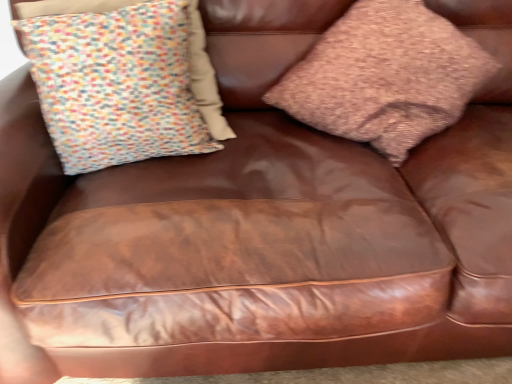
Describe the element at coordinates (123, 84) in the screenshot. This screenshot has height=384, width=512. I see `multicolored fabric pillow at upper left, which appears as the second pillow when viewed from the right` at that location.

At what (x,y) coordinates should I click in order to perform the action: click on multicolored fabric pillow at upper left, which appears as the second pillow when viewed from the right. Please return your answer as a coordinate pair (x, y). Looking at the image, I should click on (123, 84).

Identify the location of brown textured pillow at upper right, the 2th pillow viewed from the left. (385, 76).

Measure the distance between brown textured pillow at upper right, which is counted as the first pillow, starting from the right, and camera.

The distance of brown textured pillow at upper right, which is counted as the first pillow, starting from the right, from camera is 1.05 meters.

Describe the element at coordinates (385, 76) in the screenshot. I see `brown textured pillow at upper right, which is counted as the first pillow, starting from the right` at that location.

Locate an element on the screen. This screenshot has width=512, height=384. multicolored fabric pillow at upper left, which appears as the second pillow when viewed from the right is located at coordinates (123, 84).

Which object is positioned more to the right, multicolored fabric pillow at upper left, acting as the 1th pillow starting from the left, or brown textured pillow at upper right, the 2th pillow viewed from the left?

Positioned to the right is brown textured pillow at upper right, the 2th pillow viewed from the left.

Does multicolored fabric pillow at upper left, which appears as the second pillow when viewed from the right, come in front of brown textured pillow at upper right, the 2th pillow viewed from the left?

No, multicolored fabric pillow at upper left, which appears as the second pillow when viewed from the right, is further to the viewer.

Is point (68, 46) positioned before point (388, 145)?

Yes.

From the image's perspective, is multicolored fabric pillow at upper left, which appears as the second pillow when viewed from the right, under brown textured pillow at upper right, which is counted as the first pillow, starting from the right?

Yes, from the image's perspective, multicolored fabric pillow at upper left, which appears as the second pillow when viewed from the right, is beneath brown textured pillow at upper right, which is counted as the first pillow, starting from the right.

From a real-world perspective, is multicolored fabric pillow at upper left, which appears as the second pillow when viewed from the right, physically above brown textured pillow at upper right, the 2th pillow viewed from the left?

Yes.

In the scene shown: Does multicolored fabric pillow at upper left, which appears as the second pillow when viewed from the right, have a greater width compared to brown textured pillow at upper right, the 2th pillow viewed from the left?

Incorrect, the width of multicolored fabric pillow at upper left, which appears as the second pillow when viewed from the right, does not surpass that of brown textured pillow at upper right, the 2th pillow viewed from the left.

Can you confirm if multicolored fabric pillow at upper left, acting as the 1th pillow starting from the left, is taller than brown textured pillow at upper right, which is counted as the first pillow, starting from the right?

No.

Is multicolored fabric pillow at upper left, acting as the 1th pillow starting from the left, bigger or smaller than brown textured pillow at upper right, which is counted as the first pillow, starting from the right?

Considering their sizes, multicolored fabric pillow at upper left, acting as the 1th pillow starting from the left, takes up less space than brown textured pillow at upper right, which is counted as the first pillow, starting from the right.

From the picture: Do you think multicolored fabric pillow at upper left, which appears as the second pillow when viewed from the right, is within brown textured pillow at upper right, the 2th pillow viewed from the left, or outside of it?

multicolored fabric pillow at upper left, which appears as the second pillow when viewed from the right, is not inside brown textured pillow at upper right, the 2th pillow viewed from the left, it's outside.

Is multicolored fabric pillow at upper left, which appears as the second pillow when viewed from the right, not close to brown textured pillow at upper right, the 2th pillow viewed from the left?

multicolored fabric pillow at upper left, which appears as the second pillow when viewed from the right, is near brown textured pillow at upper right, the 2th pillow viewed from the left, not far away.

Is multicolored fabric pillow at upper left, which appears as the second pillow when viewed from the right, looking in the opposite direction of brown textured pillow at upper right, the 2th pillow viewed from the left?

That's not correct — multicolored fabric pillow at upper left, which appears as the second pillow when viewed from the right, is not looking away from brown textured pillow at upper right, the 2th pillow viewed from the left.

What's the angular difference between multicolored fabric pillow at upper left, acting as the 1th pillow starting from the left, and brown textured pillow at upper right, which is counted as the first pillow, starting from the right,'s facing directions?

The angular difference between multicolored fabric pillow at upper left, acting as the 1th pillow starting from the left, and brown textured pillow at upper right, which is counted as the first pillow, starting from the right, is 7.88 degrees.

At what (x,y) coordinates should I click in order to perform the action: click on pillow behind the brown textured pillow at upper right, the 2th pillow viewed from the left. Please return your answer as a coordinate pair (x, y). The width and height of the screenshot is (512, 384). Looking at the image, I should click on (123, 84).

Is brown textured pillow at upper right, which is counted as the first pillow, starting from the right, to the right of multicolored fabric pillow at upper left, which appears as the second pillow when viewed from the right, from the viewer's perspective?

Yes, brown textured pillow at upper right, which is counted as the first pillow, starting from the right, is to the right of multicolored fabric pillow at upper left, which appears as the second pillow when viewed from the right.

Considering the positions of objects brown textured pillow at upper right, which is counted as the first pillow, starting from the right, and multicolored fabric pillow at upper left, which appears as the second pillow when viewed from the right, in the image provided, who is in front, brown textured pillow at upper right, which is counted as the first pillow, starting from the right, or multicolored fabric pillow at upper left, which appears as the second pillow when viewed from the right,?

brown textured pillow at upper right, which is counted as the first pillow, starting from the right, is more forward.

Does point (462, 91) lie in front of point (76, 73)?

No.

From the image's perspective, is brown textured pillow at upper right, which is counted as the first pillow, starting from the right, located above or below multicolored fabric pillow at upper left, which appears as the second pillow when viewed from the right?

Based on their image positions, brown textured pillow at upper right, which is counted as the first pillow, starting from the right, is located above multicolored fabric pillow at upper left, which appears as the second pillow when viewed from the right.

From a real-world perspective, between brown textured pillow at upper right, which is counted as the first pillow, starting from the right, and multicolored fabric pillow at upper left, which appears as the second pillow when viewed from the right, who is vertically higher?

In real-world perspective, multicolored fabric pillow at upper left, which appears as the second pillow when viewed from the right, is above.

Which of these two, brown textured pillow at upper right, the 2th pillow viewed from the left, or multicolored fabric pillow at upper left, which appears as the second pillow when viewed from the right, is wider?

brown textured pillow at upper right, the 2th pillow viewed from the left, is wider.

Considering the relative sizes of brown textured pillow at upper right, which is counted as the first pillow, starting from the right, and multicolored fabric pillow at upper left, acting as the 1th pillow starting from the left, in the image provided, is brown textured pillow at upper right, which is counted as the first pillow, starting from the right, taller than multicolored fabric pillow at upper left, acting as the 1th pillow starting from the left,?

Indeed, brown textured pillow at upper right, which is counted as the first pillow, starting from the right, has a greater height compared to multicolored fabric pillow at upper left, acting as the 1th pillow starting from the left.

Between brown textured pillow at upper right, the 2th pillow viewed from the left, and multicolored fabric pillow at upper left, acting as the 1th pillow starting from the left, which one has larger size?

With larger size is brown textured pillow at upper right, the 2th pillow viewed from the left.

Would you say brown textured pillow at upper right, which is counted as the first pillow, starting from the right, is outside multicolored fabric pillow at upper left, which appears as the second pillow when viewed from the right?

Absolutely, brown textured pillow at upper right, which is counted as the first pillow, starting from the right, is external to multicolored fabric pillow at upper left, which appears as the second pillow when viewed from the right.

Is brown textured pillow at upper right, the 2th pillow viewed from the left, touching multicolored fabric pillow at upper left, acting as the 1th pillow starting from the left?

There is a gap between brown textured pillow at upper right, the 2th pillow viewed from the left, and multicolored fabric pillow at upper left, acting as the 1th pillow starting from the left.

Is brown textured pillow at upper right, which is counted as the first pillow, starting from the right, looking in the opposite direction of multicolored fabric pillow at upper left, which appears as the second pillow when viewed from the right?

That's not correct — brown textured pillow at upper right, which is counted as the first pillow, starting from the right, is not looking away from multicolored fabric pillow at upper left, which appears as the second pillow when viewed from the right.

How many degrees apart are the facing directions of brown textured pillow at upper right, the 2th pillow viewed from the left, and multicolored fabric pillow at upper left, acting as the 1th pillow starting from the left?

They differ by 7.88 degrees in their facing directions.

How far apart are brown textured pillow at upper right, the 2th pillow viewed from the left, and multicolored fabric pillow at upper left, acting as the 1th pillow starting from the left?

brown textured pillow at upper right, the 2th pillow viewed from the left, is 16.08 inches from multicolored fabric pillow at upper left, acting as the 1th pillow starting from the left.

Locate an element on the screen. Image resolution: width=512 pixels, height=384 pixels. pillow below the brown textured pillow at upper right, which is counted as the first pillow, starting from the right (from the image's perspective) is located at coordinates (x=123, y=84).

You are a GUI agent. You are given a task and a screenshot of the screen. Output one action in this format:
    pyautogui.click(x=<x>, y=<y>)
    Task: Click on the pillow lying on the right of multicolored fabric pillow at upper left, acting as the 1th pillow starting from the left
    
    Given the screenshot: What is the action you would take?
    pyautogui.click(x=385, y=76)

Identify the location of pillow below the multicolored fabric pillow at upper left, acting as the 1th pillow starting from the left (from a real-world perspective). (385, 76).